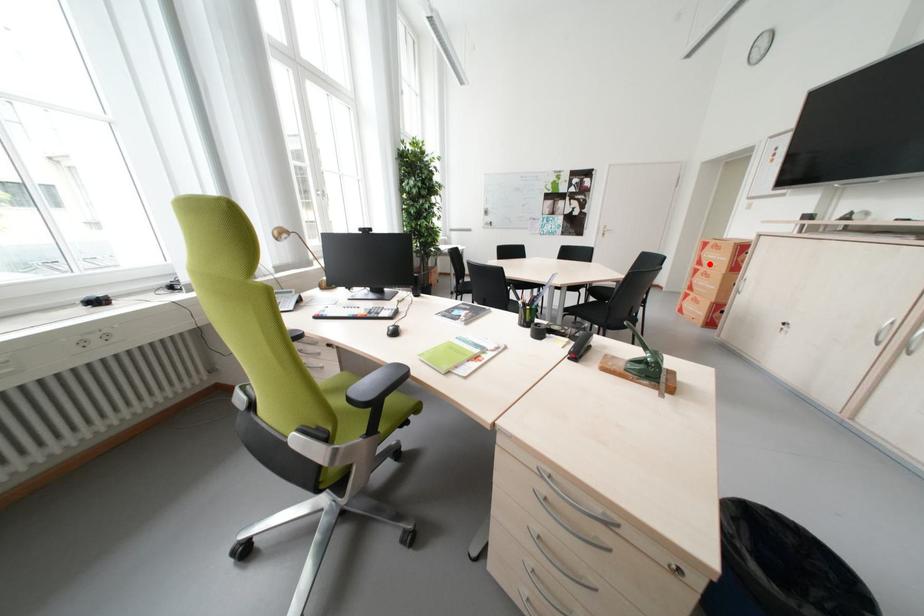
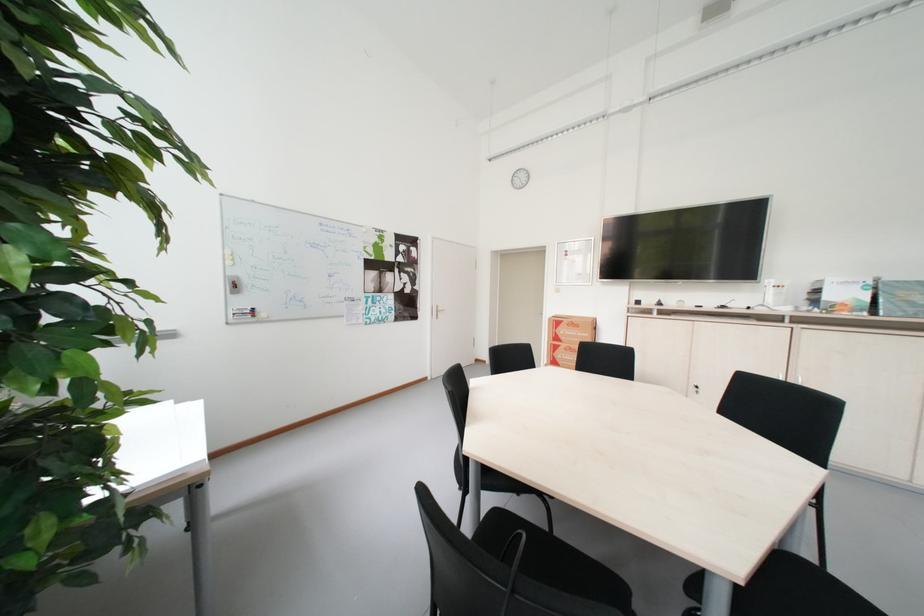
The point at the highlighted location is marked in the first image. Where is the corresponding point in the second image?

(565, 341)